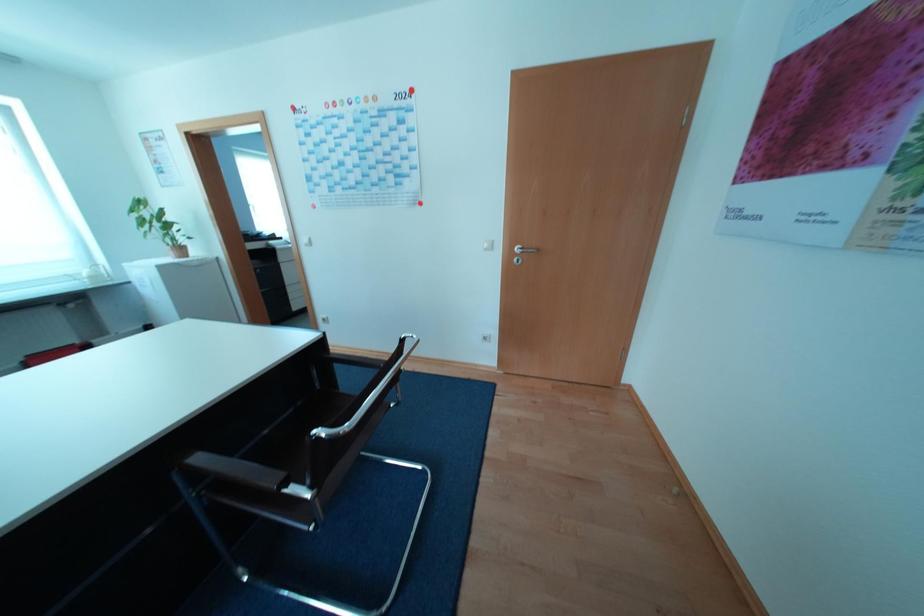
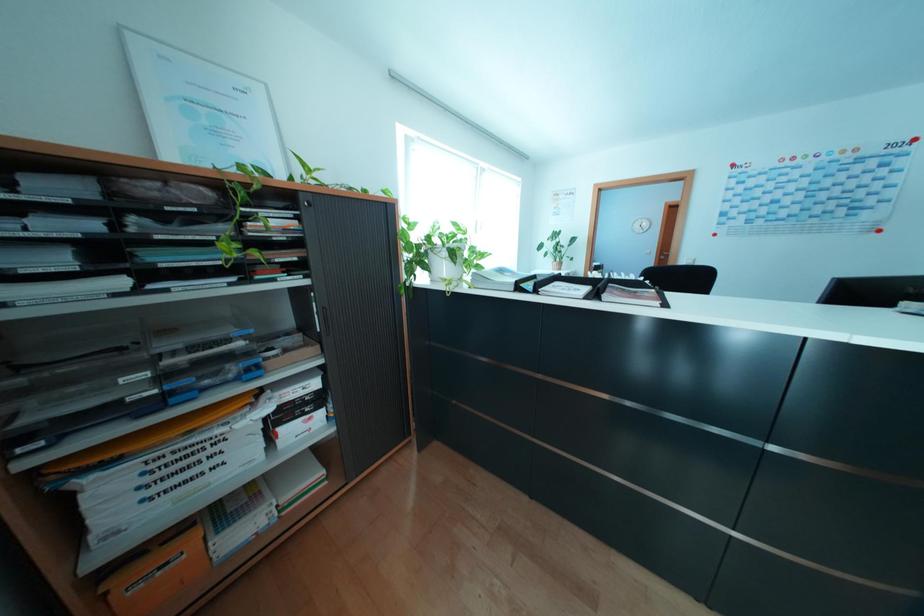
In a continuous first-person perspective shot, in which direction is the camera moving?

The cameraman walked toward left, backward.